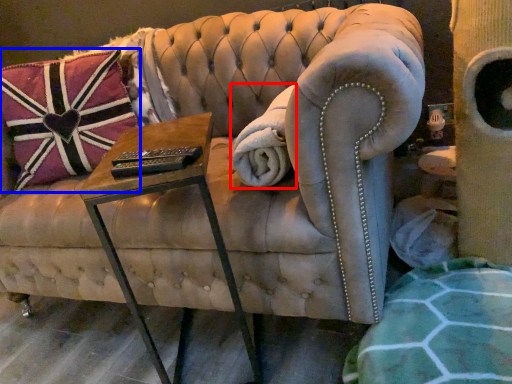
Question: Which object is further to the camera taking this photo, blanket (highlighted by a red box) or pillow (highlighted by a blue box)?

Choices:
 (A) blanket
 (B) pillow

Answer: (B)